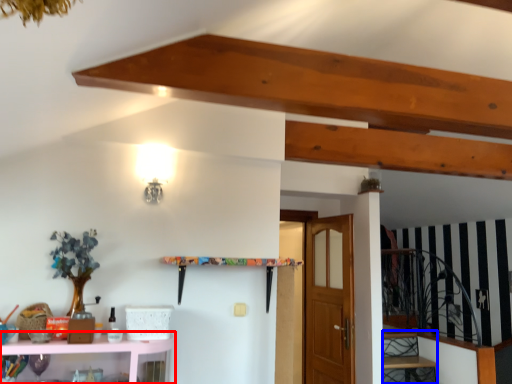
Question: Which of the following is the closest to the observer, shelf (highlighted by a red box) or stairwell (highlighted by a blue box)?

Choices:
 (A) shelf
 (B) stairwell

Answer: (A)